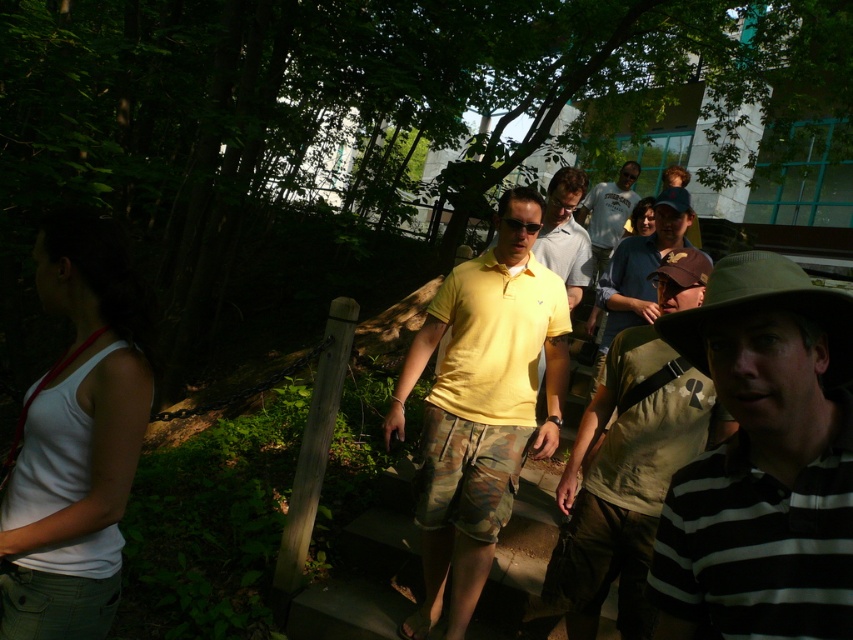
Is yellow matte polo shirt at center shorter than camouflage shorts at center?

Yes, yellow matte polo shirt at center is shorter than camouflage shorts at center.

Does yellow matte polo shirt at center have a lesser width compared to camouflage shorts at center?

Yes, yellow matte polo shirt at center is thinner than camouflage shorts at center.

Between point (447, 323) and point (624, 275), which one is positioned in front?

Point (447, 323) is in front.

At what (x,y) coordinates should I click in order to perform the action: click on yellow matte polo shirt at center. Please return your answer as a coordinate pair (x, y). The image size is (853, 640). Looking at the image, I should click on (495, 339).

Does white fabric tank top at left have a smaller size compared to yellow matte polo shirt at center?

Incorrect, white fabric tank top at left is not smaller in size than yellow matte polo shirt at center.

Who is shorter, white fabric tank top at left or yellow matte polo shirt at center?

yellow matte polo shirt at center is shorter.

You are a GUI agent. You are given a task and a screenshot of the screen. Output one action in this format:
    pyautogui.click(x=<x>, y=<y>)
    Task: Click on the white fabric tank top at left
    
    Given the screenshot: What is the action you would take?
    76,436

Does point (144, 323) lie behind point (614, 259)?

No, (144, 323) is closer to viewer.

Can you confirm if white fabric tank top at left is wider than camouflage shorts at center?

No, white fabric tank top at left is not wider than camouflage shorts at center.

Does point (35, 480) come behind point (589, 396)?

No, it is not.

Find the location of a particular element. The height and width of the screenshot is (640, 853). white fabric tank top at left is located at coordinates (76, 436).